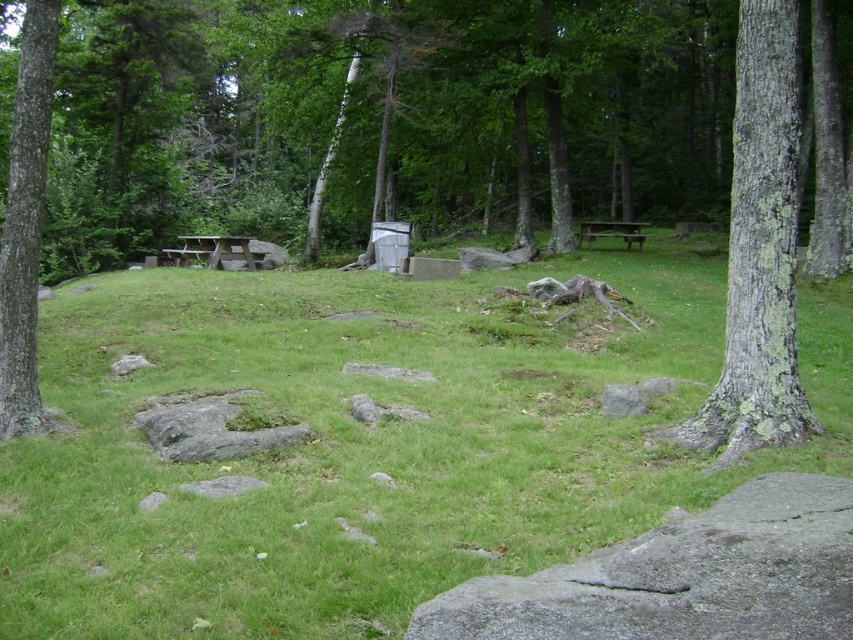
You are standing at the edge of the clearing in the forest scene. You notice two points marked in the image. Which point, point (70, 602) or point (183, 260), is closer to you?

Point (70, 602) is closer to the viewer than point (183, 260).